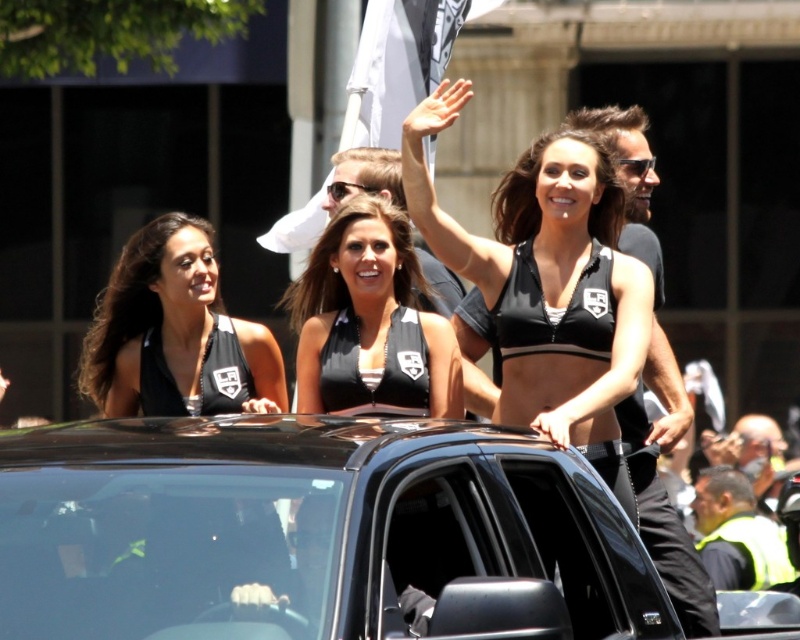
Is black glossy suv at center wider than black matte bikini top at center?

No, black glossy suv at center is not wider than black matte bikini top at center.

In order to click on black glossy suv at center in this screenshot , I will do `click(306, 531)`.

Does black matte tank top at upper left have a smaller size compared to black matte bikini top at center?

Actually, black matte tank top at upper left might be larger than black matte bikini top at center.

Consider the image. How far apart are black matte tank top at upper left and black matte bikini top at center?

22.01 feet

Who is more forward, [150,316] or [310,400]?

Positioned in front is point [310,400].

Find the location of a particular element. This screenshot has height=640, width=800. black matte tank top at upper left is located at coordinates (176, 333).

Who is lower down, black matte tank top at upper left or white fabric flag at upper center?

Positioned lower is black matte tank top at upper left.

Where is `black matte tank top at upper left`? The width and height of the screenshot is (800, 640). black matte tank top at upper left is located at coordinates (176, 333).